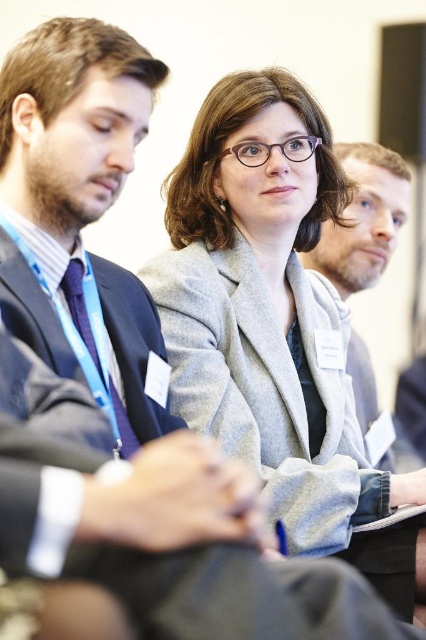
You are a photographer adjusting your camera to focus on the gray woolen blazer at center. The camera has a focus point at position point (276, 324). Is the focus point correctly positioned to capture the gray woolen blazer at center?

Yes, the focus point at point (276, 324) is correctly positioned because the Objects Description states that the point marks the gray woolen blazer at center.

You are organizing a closet and have two garments labeled as gray woolen blazer at center and gray woolen jacket at center. If you want to store them vertically in a closet with a width of 1.2 meters, which one would require more space horizontally?

The gray woolen blazer at center requires more horizontal space because its width is larger than the gray woolen jacket at center.